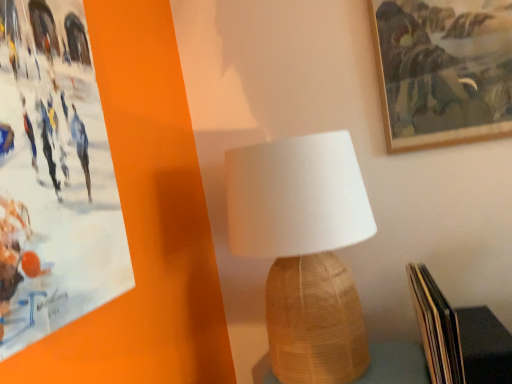
Question: Does woven wood table at center turn towards hardcover book at lower right?

Choices:
 (A) yes
 (B) no

Answer: (B)

Question: Is hardcover book at lower right a part of woven wood table at center?

Choices:
 (A) no
 (B) yes

Answer: (A)

Question: From a real-world perspective, is woven wood table at center on hardcover book at lower right?

Choices:
 (A) no
 (B) yes

Answer: (A)

Question: From the image's perspective, does woven wood table at center appear higher than hardcover book at lower right?

Choices:
 (A) yes
 (B) no

Answer: (B)

Question: Considering the relative positions of woven wood table at center and hardcover book at lower right in the image provided, is woven wood table at center to the right of hardcover book at lower right from the viewer's perspective?

Choices:
 (A) no
 (B) yes

Answer: (A)

Question: Does woven wood table at center have a greater width compared to hardcover book at lower right?

Choices:
 (A) no
 (B) yes

Answer: (A)

Question: From the image's perspective, is woven wood table at center located beneath white woven lampshade at center?

Choices:
 (A) yes
 (B) no

Answer: (A)

Question: Does woven wood table at center come in front of white woven lampshade at center?

Choices:
 (A) no
 (B) yes

Answer: (A)

Question: Considering the relative sizes of woven wood table at center and white woven lampshade at center in the image provided, is woven wood table at center taller than white woven lampshade at center?

Choices:
 (A) no
 (B) yes

Answer: (A)

Question: Is woven wood table at center in contact with white woven lampshade at center?

Choices:
 (A) yes
 (B) no

Answer: (B)

Question: Does woven wood table at center come behind white woven lampshade at center?

Choices:
 (A) no
 (B) yes

Answer: (B)

Question: Considering the relative positions of woven wood table at center and white woven lampshade at center in the image provided, is woven wood table at center to the left of white woven lampshade at center from the viewer's perspective?

Choices:
 (A) no
 (B) yes

Answer: (A)

Question: Does woven wood table at center turn towards wooden picture frame at upper right?

Choices:
 (A) no
 (B) yes

Answer: (A)